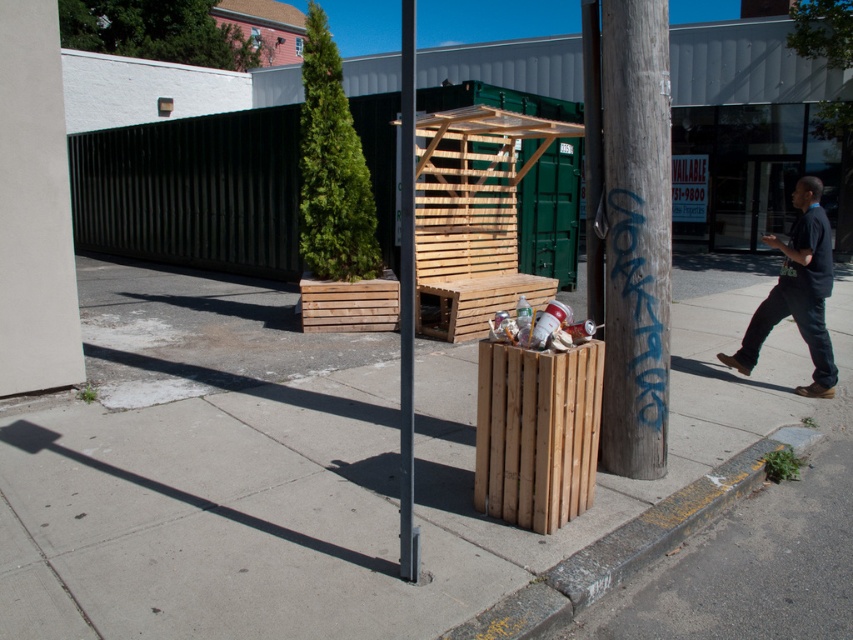
Question: Among these objects, which one is farthest from the camera?

Choices:
 (A) weathered wood pole at right
 (B) dark blue shirt at right

Answer: (B)

Question: Can you confirm if weathered wood pole at right is positioned to the left of dark blue shirt at right?

Choices:
 (A) yes
 (B) no

Answer: (A)

Question: Which point is closer to the camera?

Choices:
 (A) dark blue shirt at right
 (B) weathered wood pole at right

Answer: (B)

Question: Is wooden crate at center thinner than concrete curb at lower right?

Choices:
 (A) no
 (B) yes

Answer: (A)

Question: Among these points, which one is farthest from the camera?

Choices:
 (A) (822, 362)
 (B) (619, 180)
 (C) (525, 566)
 (D) (410, 374)

Answer: (A)

Question: Can you confirm if weathered wood pole at right is wider than dark blue shirt at right?

Choices:
 (A) no
 (B) yes

Answer: (B)